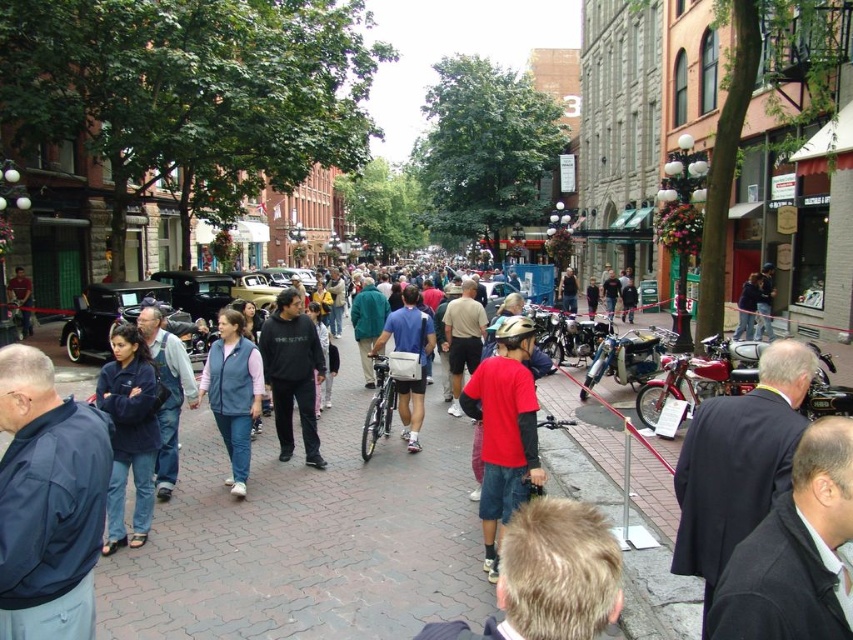
Between point (68, 472) and point (175, 381), which one is positioned in front?

Positioned in front is point (68, 472).

Measure the distance between blue fabric jacket at left and denim jacket at left.

They are 27.81 feet apart.

Is point (62, 452) less distant than point (177, 380)?

Yes, it is.

What are the coordinates of `blue fabric jacket at left` in the screenshot? It's located at (48, 500).

Who is lower down, blue fabric jacket at left or matte black jacket at left?

blue fabric jacket at left is lower down.

Can you confirm if blue fabric jacket at left is taller than matte black jacket at left?

Yes.

Is point (10, 513) closer to camera compared to point (22, 320)?

Yes, point (10, 513) is closer to viewer.

The image size is (853, 640). I want to click on blue fabric jacket at left, so click(x=48, y=500).

Between red matte shirt at center and dark gray sweatshirt at center, which one appears on the left side from the viewer's perspective?

dark gray sweatshirt at center

Between red matte shirt at center and dark gray sweatshirt at center, which one has more height?

Standing taller between the two is red matte shirt at center.

The height and width of the screenshot is (640, 853). I want to click on red matte shirt at center, so click(x=503, y=429).

Where is `red matte shirt at center`? This screenshot has height=640, width=853. red matte shirt at center is located at coordinates (503, 429).